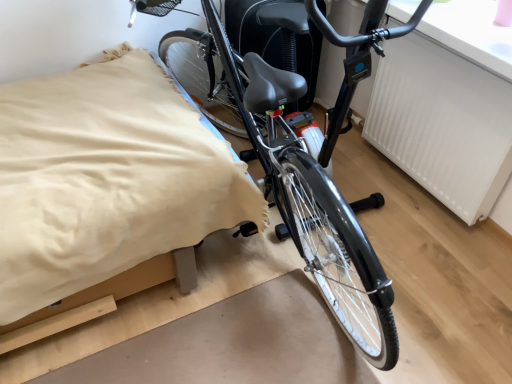
Question: Should I look upward or downward to see shiny black bicycle at center?

Choices:
 (A) down
 (B) up

Answer: (B)

Question: Is beige fabric bed at center not inside white textured radiator at upper right?

Choices:
 (A) no
 (B) yes

Answer: (B)

Question: Is beige fabric bed at center closer to camera compared to white textured radiator at upper right?

Choices:
 (A) yes
 (B) no

Answer: (A)

Question: Is white textured radiator at upper right surrounded by beige fabric bed at center?

Choices:
 (A) no
 (B) yes

Answer: (A)

Question: From a real-world perspective, is beige fabric bed at center physically below white textured radiator at upper right?

Choices:
 (A) no
 (B) yes

Answer: (B)

Question: Is beige fabric bed at center to the right of white textured radiator at upper right from the viewer's perspective?

Choices:
 (A) no
 (B) yes

Answer: (A)

Question: From a real-world perspective, is beige fabric bed at center positioned over white textured radiator at upper right based on gravity?

Choices:
 (A) no
 (B) yes

Answer: (A)

Question: Is beige fabric bed at center wider than shiny black bicycle at center?

Choices:
 (A) yes
 (B) no

Answer: (B)

Question: Would you say beige fabric bed at center is outside shiny black bicycle at center?

Choices:
 (A) yes
 (B) no

Answer: (B)

Question: Considering the relative sizes of beige fabric bed at center and shiny black bicycle at center in the image provided, is beige fabric bed at center thinner than shiny black bicycle at center?

Choices:
 (A) yes
 (B) no

Answer: (A)

Question: From a real-world perspective, is beige fabric bed at center below shiny black bicycle at center?

Choices:
 (A) yes
 (B) no

Answer: (A)

Question: Is beige fabric bed at center to the right of shiny black bicycle at center from the viewer's perspective?

Choices:
 (A) yes
 (B) no

Answer: (B)

Question: Is beige fabric bed at center at the left side of shiny black bicycle at center?

Choices:
 (A) no
 (B) yes

Answer: (B)

Question: Is white textured radiator at upper right positioned before beige fabric bed at center?

Choices:
 (A) yes
 (B) no

Answer: (B)